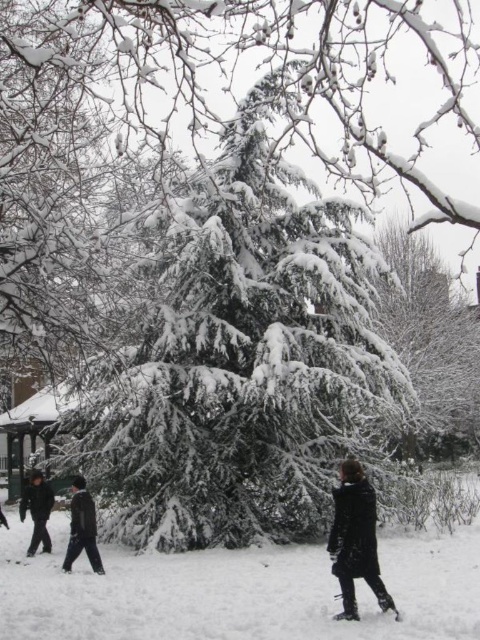
Question: Can you confirm if black matte coat at lower right is bigger than black matte jacket at lower left?

Choices:
 (A) yes
 (B) no

Answer: (B)

Question: Does black matte jacket at lower left appear on the left side of dark gray coat at lower left?

Choices:
 (A) no
 (B) yes

Answer: (A)

Question: Which of the following is the closest to the observer?

Choices:
 (A) (3, 528)
 (B) (78, 525)
 (C) (204, 262)

Answer: (B)

Question: Based on their relative distances, which object is farther from the snow-covered evergreen at center?

Choices:
 (A) dark gray coat at lower left
 (B) white fluffy snow at center
 (C) green textured pine tree at center

Answer: (A)

Question: Which of the following is the farthest from the observer?

Choices:
 (A) coord(404,442)
 (B) coord(363,513)
 (C) coord(1,513)
 (D) coord(274,394)

Answer: (A)

Question: Is snow-covered evergreen at center below black matte coat at lower right?

Choices:
 (A) yes
 (B) no

Answer: (B)